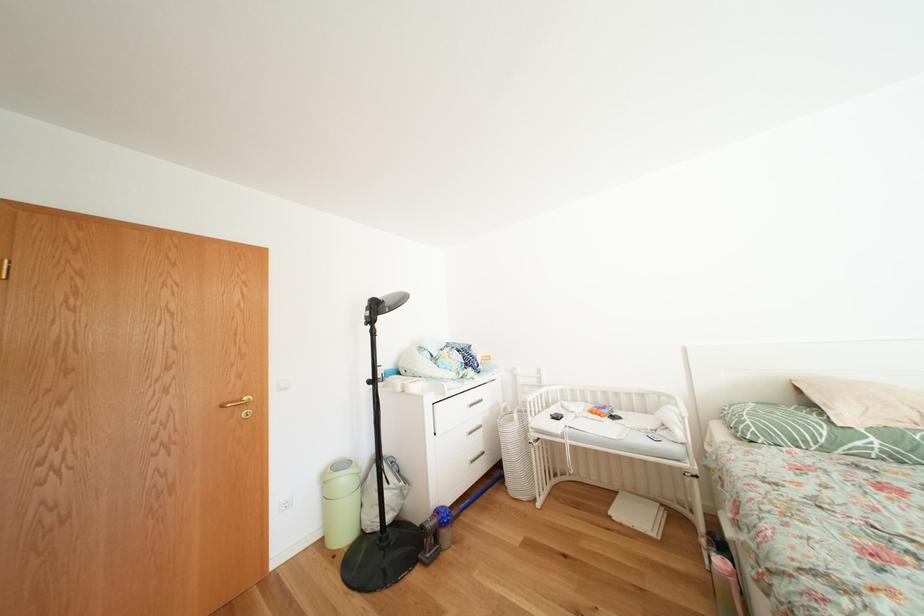
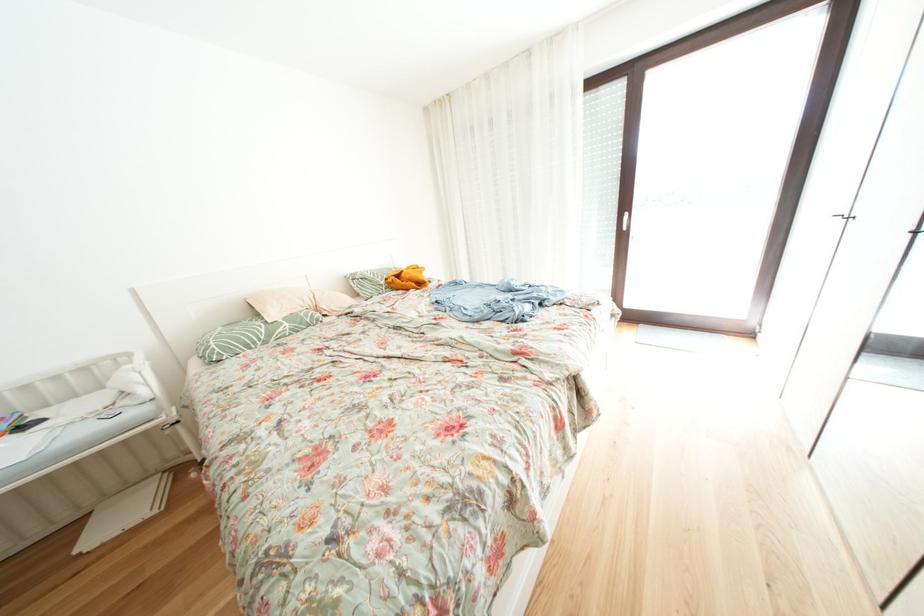
The images are taken continuously from a first-person perspective. In which direction is your viewpoint rotating?

The camera rotated toward right-down.